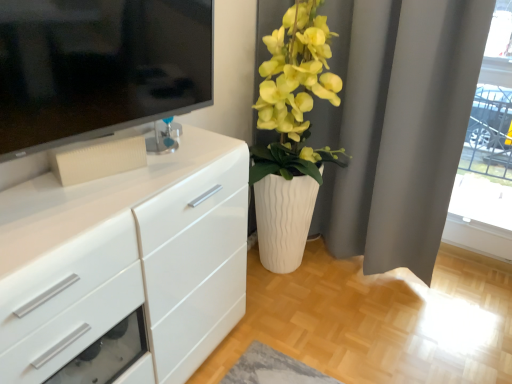
Identify the location of transparent glass door at upper right. The height and width of the screenshot is (384, 512). (489, 134).

Where is `white matte curtain at upper right`? white matte curtain at upper right is located at coordinates (424, 130).

Between point (229, 320) and point (475, 46), which one is positioned in front?

The point (475, 46) is closer.

Considering their positions, is white glossy chest of drawers at left located in front of or behind white matte curtain at upper right?

Clearly, white glossy chest of drawers at left is in front of white matte curtain at upper right.

From the image's perspective, which one is positioned lower, white glossy chest of drawers at left or white matte curtain at upper right?

white glossy chest of drawers at left is shown below in the image.

In the scene shown: Considering the relative sizes of transparent glass door at upper right and white glossy chest of drawers at left in the image provided, is transparent glass door at upper right bigger than white glossy chest of drawers at left?

No.

Can you confirm if transparent glass door at upper right is taller than white glossy chest of drawers at left?

Indeed, transparent glass door at upper right has a greater height compared to white glossy chest of drawers at left.

From a real-world perspective, does transparent glass door at upper right sit lower than white glossy chest of drawers at left?

No, from a real-world perspective, transparent glass door at upper right is not beneath white glossy chest of drawers at left.

From their relative heights in the image, would you say white matte curtain at upper right is taller or shorter than transparent glass door at upper right?

In the image, white matte curtain at upper right appears to be taller than transparent glass door at upper right.

Between point (396, 128) and point (504, 179), which one is positioned behind?

The point (504, 179) is more distant.

Does point (500, 213) come behind point (455, 74)?

Yes, point (500, 213) is behind point (455, 74).

Between transparent glass door at upper right and white matte curtain at upper right, which one has smaller size?

transparent glass door at upper right.

Who is more distant, transparent glass door at upper right or white matte curtain at upper right?

transparent glass door at upper right is further from the camera.

Which is more to the right, transparent glass door at upper right or white matte curtain at upper right?

Positioned to the right is transparent glass door at upper right.

Does point (293, 121) come closer to viewer compared to point (508, 145)?

Yes, point (293, 121) is in front of point (508, 145).

Is matte white vase at center right to the left or to the right of transparent glass door at upper right in the image?

From the image, it's evident that matte white vase at center right is to the left of transparent glass door at upper right.

Who is bigger, white matte curtain at upper right or white glossy chest of drawers at left?

white glossy chest of drawers at left is bigger.

Is white matte curtain at upper right further to camera compared to white glossy chest of drawers at left?

That is True.

From the image's perspective, is white matte curtain at upper right above white glossy chest of drawers at left?

Correct, white matte curtain at upper right appears higher than white glossy chest of drawers at left in the image.

Does white matte curtain at upper right appear on the right side of white glossy chest of drawers at left?

Correct, you'll find white matte curtain at upper right to the right of white glossy chest of drawers at left.

From a real-world perspective, is transparent glass door at upper right physically located above or below matte white vase at center right?

Clearly, from a real-world perspective, transparent glass door at upper right is above matte white vase at center right.

Is transparent glass door at upper right not inside matte white vase at center right?

Absolutely, transparent glass door at upper right is external to matte white vase at center right.

Which is more to the right, transparent glass door at upper right or matte white vase at center right?

transparent glass door at upper right.

Find the location of `curtain above the white glossy chest of drawers at left (from a real-world perspective)`. curtain above the white glossy chest of drawers at left (from a real-world perspective) is located at coordinates (424, 130).

Locate an element on the screen. This screenshot has height=384, width=512. glass door above the white glossy chest of drawers at left (from the image's perspective) is located at coordinates (489, 134).

Which object lies nearer to the anchor point white matte curtain at upper right, white glossy chest of drawers at left or transparent glass door at upper right?

Among the two, transparent glass door at upper right is located nearer to white matte curtain at upper right.

Consider the image. From the image, which object appears to be nearer to matte white vase at center right, transparent glass door at upper right or white glossy chest of drawers at left?

white glossy chest of drawers at left lies closer to matte white vase at center right than the other object.

Which object lies further to the anchor point white glossy chest of drawers at left, white matte curtain at upper right or transparent glass door at upper right?

transparent glass door at upper right is positioned further to the anchor white glossy chest of drawers at left.

Estimate the real-world distances between objects in this image. Which object is closer to matte white vase at center right, white matte curtain at upper right or transparent glass door at upper right?

Among the two, white matte curtain at upper right is located nearer to matte white vase at center right.

Based on their spatial positions, is white glossy chest of drawers at left or matte white vase at center right further from white matte curtain at upper right?

The object further to white matte curtain at upper right is white glossy chest of drawers at left.

Estimate the real-world distances between objects in this image. Which object is closer to transparent glass door at upper right, white matte curtain at upper right or matte white vase at center right?

Based on the image, white matte curtain at upper right appears to be nearer to transparent glass door at upper right.

When comparing their distances from matte white vase at center right, does white matte curtain at upper right or white glossy chest of drawers at left seem further?

white glossy chest of drawers at left lies further to matte white vase at center right than the other object.

When comparing their distances from white glossy chest of drawers at left, does white matte curtain at upper right or matte white vase at center right seem closer?

matte white vase at center right.

Image resolution: width=512 pixels, height=384 pixels. What are the coordinates of `curtain between matte white vase at center right and transparent glass door at upper right from left to right` in the screenshot? It's located at (424, 130).

This screenshot has height=384, width=512. Find the location of `houseplant between white glossy chest of drawers at left and white matte curtain at upper right in the horizontal direction`. houseplant between white glossy chest of drawers at left and white matte curtain at upper right in the horizontal direction is located at coordinates (291, 134).

The height and width of the screenshot is (384, 512). Identify the location of curtain between white glossy chest of drawers at left and transparent glass door at upper right in the horizontal direction. pyautogui.click(x=424, y=130).

Find the location of a particular element. houseplant located between white glossy chest of drawers at left and transparent glass door at upper right in the left-right direction is located at coordinates (291, 134).